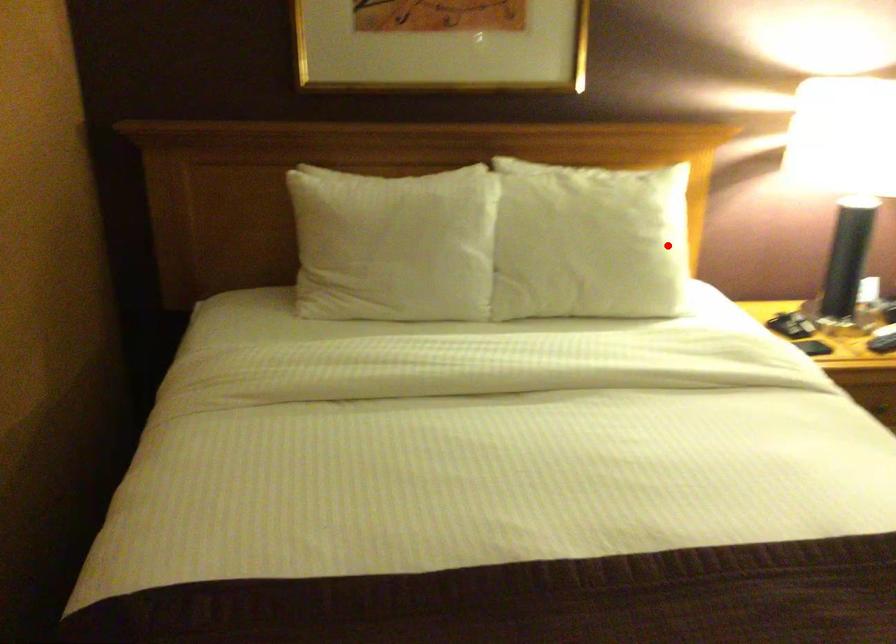
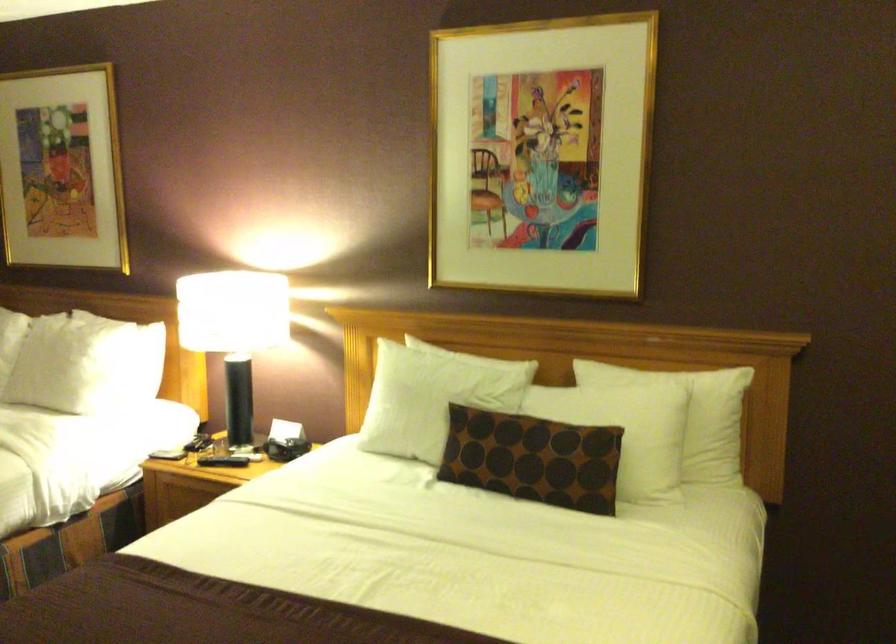
In the second image, find the point that corresponds to the highlighted location in the first image.

(73, 364)